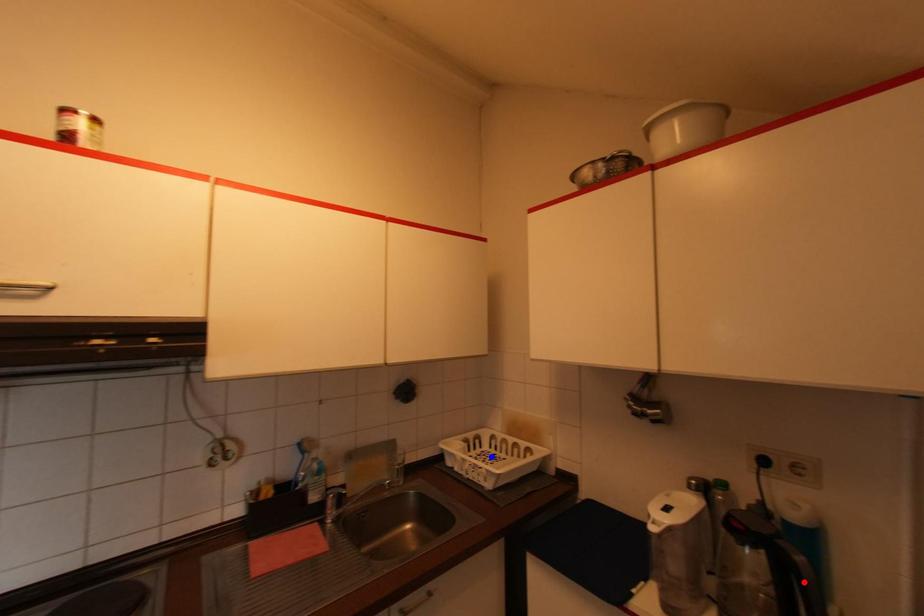
Question: Two points are marked on the image. Which point is closer to the camera?

Choices:
 (A) Blue point is closer.
 (B) Red point is closer.

Answer: (B)